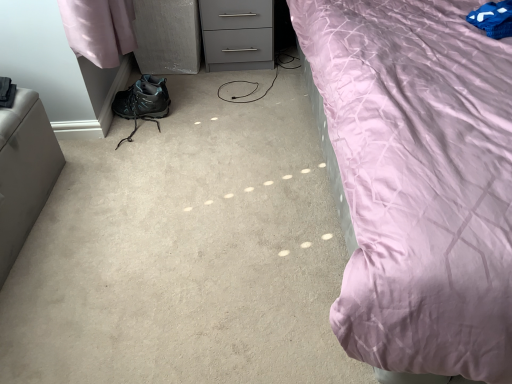
Image resolution: width=512 pixels, height=384 pixels. What are the coordinates of `unoccupied region to the right of matte black boot at lower left` in the screenshot? It's located at (191, 127).